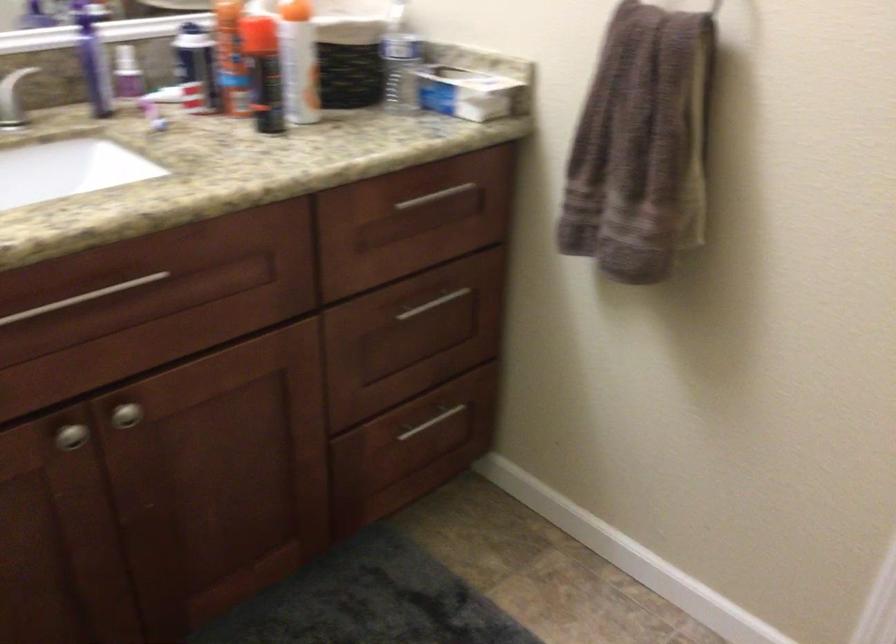
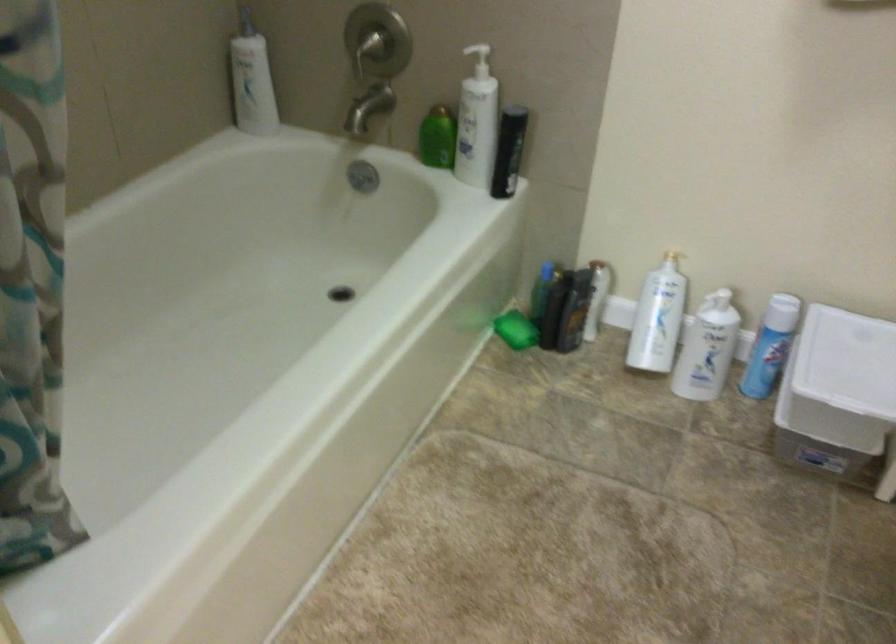
How did the camera likely rotate?

The camera rotated toward right-down.